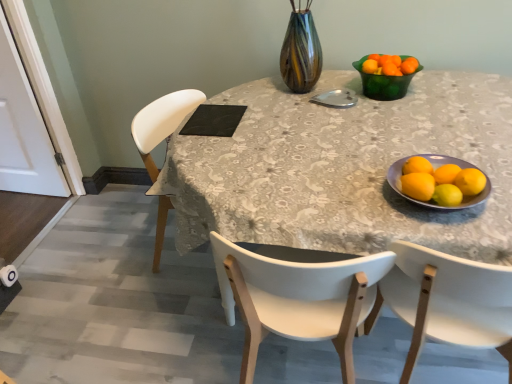
Question: From a real-world perspective, is matte ceramic bowl at right over white wood chair at center, acting as the second chair starting from the right?

Choices:
 (A) no
 (B) yes

Answer: (B)

Question: Can you confirm if matte ceramic bowl at right is shorter than white wood chair at center, which is the 1th chair from left to right?

Choices:
 (A) no
 (B) yes

Answer: (B)

Question: Is matte ceramic bowl at right far from white wood chair at center, acting as the second chair starting from the right?

Choices:
 (A) no
 (B) yes

Answer: (A)

Question: From the image's perspective, is matte ceramic bowl at right beneath white wood chair at center, acting as the second chair starting from the right?

Choices:
 (A) no
 (B) yes

Answer: (A)

Question: Would you say matte ceramic bowl at right is outside white wood chair at center, acting as the second chair starting from the right?

Choices:
 (A) yes
 (B) no

Answer: (A)

Question: Based on their sizes in the image, would you say yellow matte lemon at right, the fourth lemon positioned from the left, is bigger or smaller than matte ceramic bowl at right?

Choices:
 (A) small
 (B) big

Answer: (A)

Question: From the image's perspective, relative to matte ceramic bowl at right, is yellow matte lemon at right, acting as the first lemon starting from the right, above or below?

Choices:
 (A) above
 (B) below

Answer: (A)

Question: In terms of height, does yellow matte lemon at right, acting as the first lemon starting from the right, look taller or shorter compared to matte ceramic bowl at right?

Choices:
 (A) short
 (B) tall

Answer: (B)

Question: Is point (468, 173) positioned closer to the camera than point (400, 170)?

Choices:
 (A) farther
 (B) closer

Answer: (B)

Question: In terms of height, does white wood chair at center, which is the 1th chair from left to right, look taller or shorter compared to yellow matte lemon at lower right, the second lemon when ordered from right to left?

Choices:
 (A) short
 (B) tall

Answer: (B)

Question: From the image's perspective, is white wood chair at center, which is the 1th chair from left to right, positioned above or below yellow matte lemon at lower right, the second lemon when ordered from right to left?

Choices:
 (A) below
 (B) above

Answer: (A)

Question: Is white wood chair at center, acting as the second chair starting from the right, situated inside yellow matte lemon at lower right, the 3th lemon viewed from the left, or outside?

Choices:
 (A) outside
 (B) inside

Answer: (A)

Question: Is point (250, 331) closer or farther from the camera than point (435, 200)?

Choices:
 (A) closer
 (B) farther

Answer: (B)

Question: In terms of height, does yellow matte lemon at right, positioned as the fourth lemon in right-to-left order, look taller or shorter compared to orange matte tangerine at upper right, which ranks as the first tangerine in right-to-left order?

Choices:
 (A) tall
 (B) short

Answer: (A)

Question: From a real-world perspective, relative to orange matte tangerine at upper right, marked as the second tangerine in a left-to-right arrangement, is yellow matte lemon at right, acting as the first lemon starting from the left, vertically above or below?

Choices:
 (A) below
 (B) above

Answer: (A)